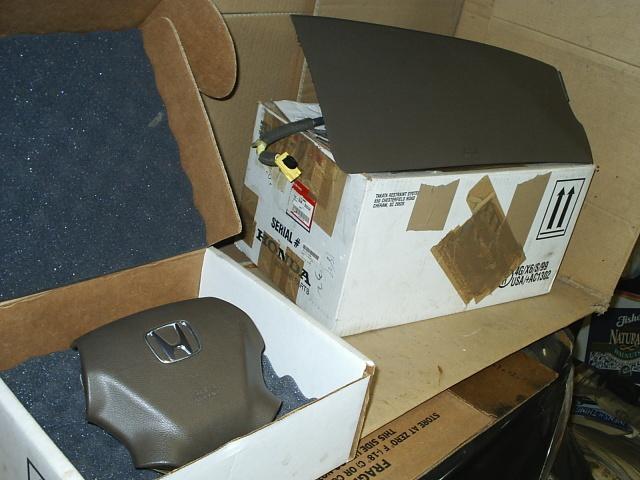
This screenshot has width=640, height=480. In order to click on open box in this screenshot , I will do `click(42, 396)`.